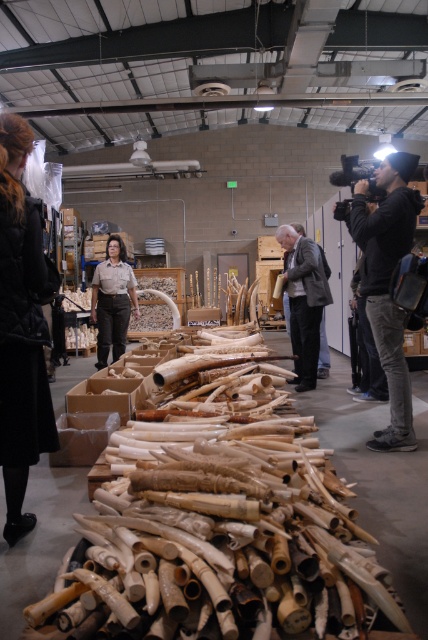
Question: Which of the following is the farthest from the observer?

Choices:
 (A) black quilted coat at center
 (B) light brown wood at center

Answer: (B)

Question: Considering the relative positions of black quilted coat at center and light brown wood at center in the image provided, where is black quilted coat at center located with respect to light brown wood at center?

Choices:
 (A) below
 (B) above

Answer: (A)

Question: Is black quilted coat at center bigger than matte khaki uniform at center?

Choices:
 (A) no
 (B) yes

Answer: (A)

Question: Where is black quilted coat at center located in relation to black hoodie at upper right in the image?

Choices:
 (A) left
 (B) right

Answer: (A)

Question: Based on their relative distances, which object is nearer to the black hoodie at upper right?

Choices:
 (A) light brown wood at center
 (B) matte khaki uniform at center
 (C) black quilted coat at center

Answer: (A)

Question: Among these points, which one is nearest to the camera?

Choices:
 (A) (377, 308)
 (B) (24, 136)
 (C) (125, 276)

Answer: (B)